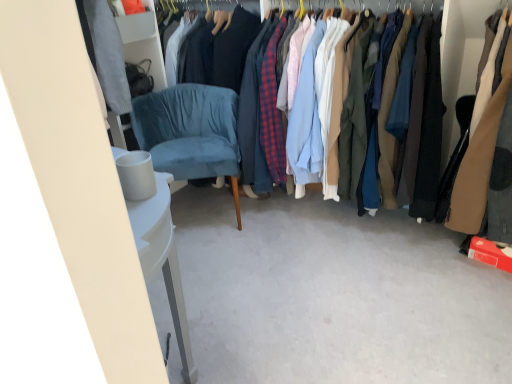
This screenshot has width=512, height=384. What are the coordinates of `free space to the left of matte cotton shirts at center, which is counted as the 2th clothing, starting from the right` in the screenshot? It's located at (238, 250).